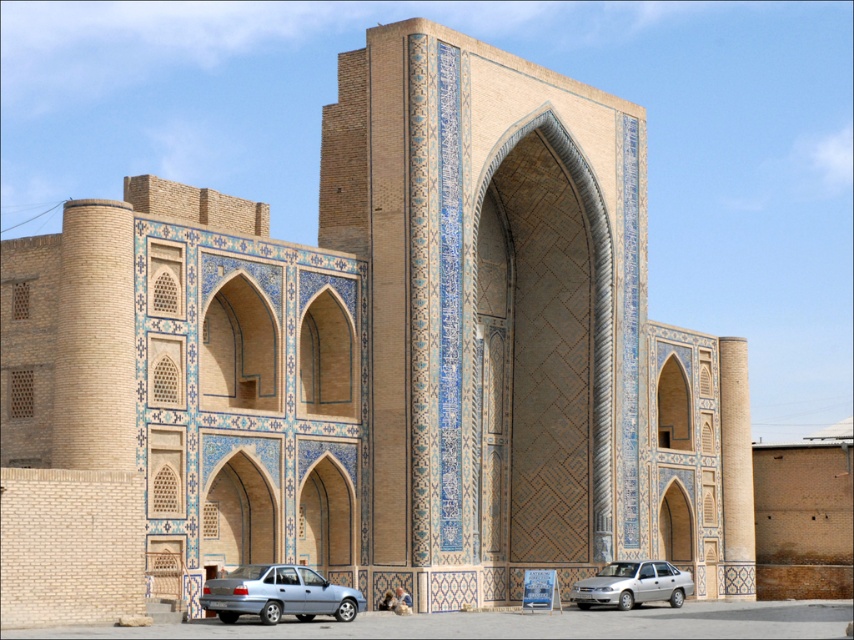
You are standing in front of the architectural structure and see the silver metallic sedan at lower center and the silver metallic car at lower center. Which one is positioned to the left?

The silver metallic sedan at lower center is positioned to the left of the silver metallic car at lower center.

You are standing in front of the architectural structure and want to walk towards the two points marked in the image. Which point, point [249,572] or point [642,579], will you reach first?

You will reach point [249,572] first because it is closer to you than point [642,579].

You are a visitor standing in front of the architectural structure. You see a silver metallic sedan at lower center and a silver metallic car at lower center. Which one is closer to you?

The silver metallic sedan at lower center is closer to you because it is in front of the silver metallic car at lower center.